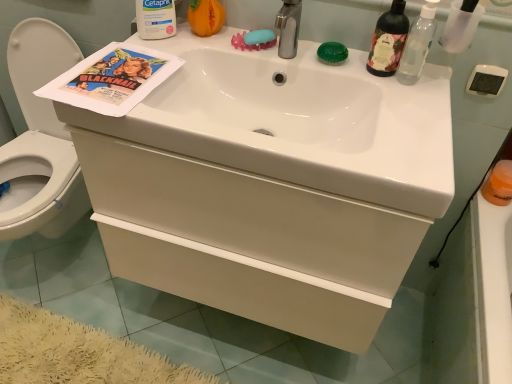
Locate an element on the screen. This screenshot has width=512, height=384. free location to the left of translucent glass bottle at upper right, the second bottle in the left-to-right sequence is located at coordinates (334, 62).